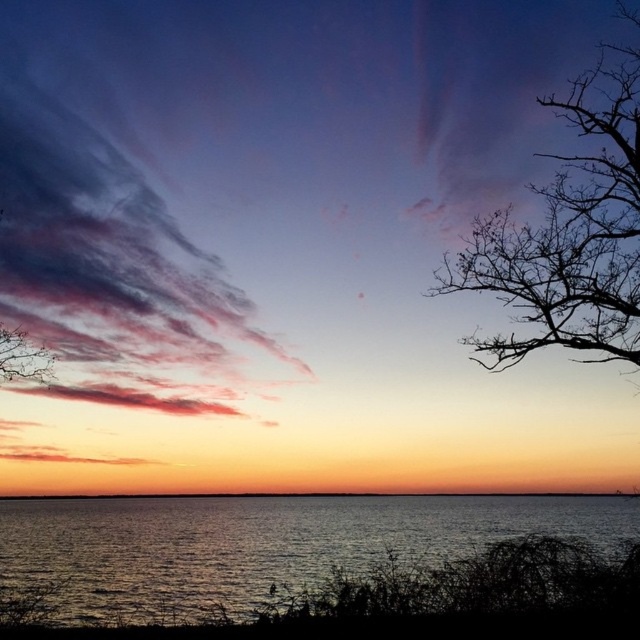
Is glistening silver water at lower center smaller than smooth orange water at center?

No, glistening silver water at lower center is not smaller than smooth orange water at center.

Does glistening silver water at lower center have a lesser width compared to smooth orange water at center?

Incorrect, glistening silver water at lower center's width is not less than smooth orange water at center's.

Is point (246, 499) positioned after point (504, 492)?

No, (246, 499) is in front of (504, 492).

Where is `glistening silver water at lower center`? The image size is (640, 640). glistening silver water at lower center is located at coordinates (257, 541).

Does point (212, 348) come in front of point (468, 243)?

No, it is not.

Between point (67, 179) and point (467, 262), which one is positioned behind?

Point (67, 179)

Where is `pastel cotton clouds at upper left`? pastel cotton clouds at upper left is located at coordinates (109, 268).

Is glistening silver water at lower center positioned before bare branches at upper left?

Yes, glistening silver water at lower center is in front of bare branches at upper left.

Does glistening silver water at lower center have a larger size compared to bare branches at upper left?

Yes.

What do you see at coordinates (257, 541) in the screenshot? I see `glistening silver water at lower center` at bounding box center [257, 541].

This screenshot has height=640, width=640. In order to click on glistening silver water at lower center in this screenshot , I will do `click(257, 541)`.